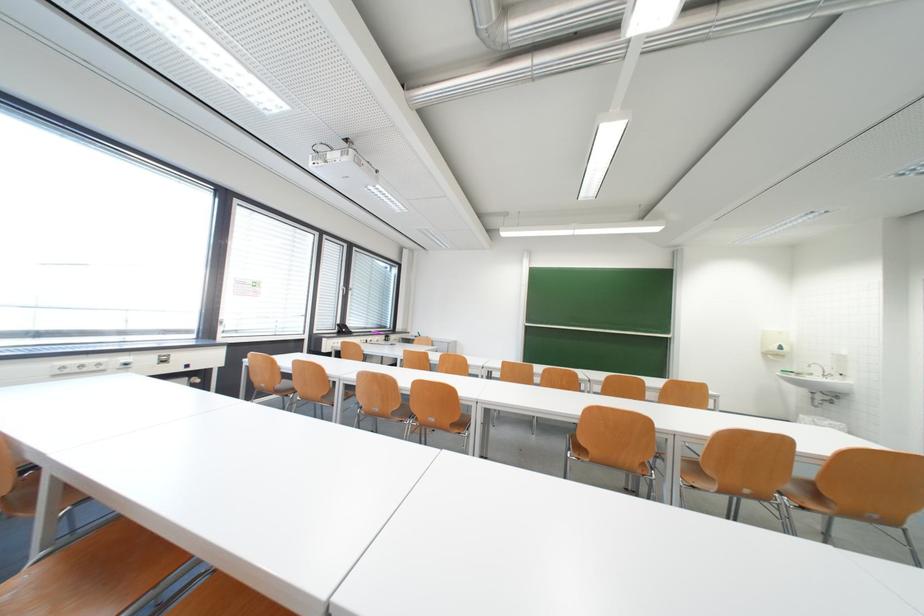
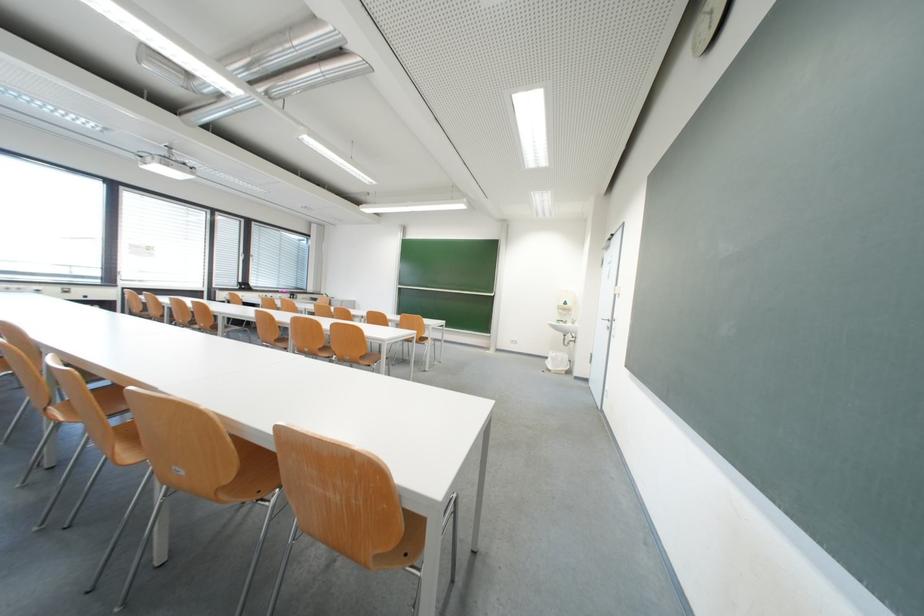
Locate, in the second image, the point that corresponds to pixel 800 378 in the first image.

(570, 326)